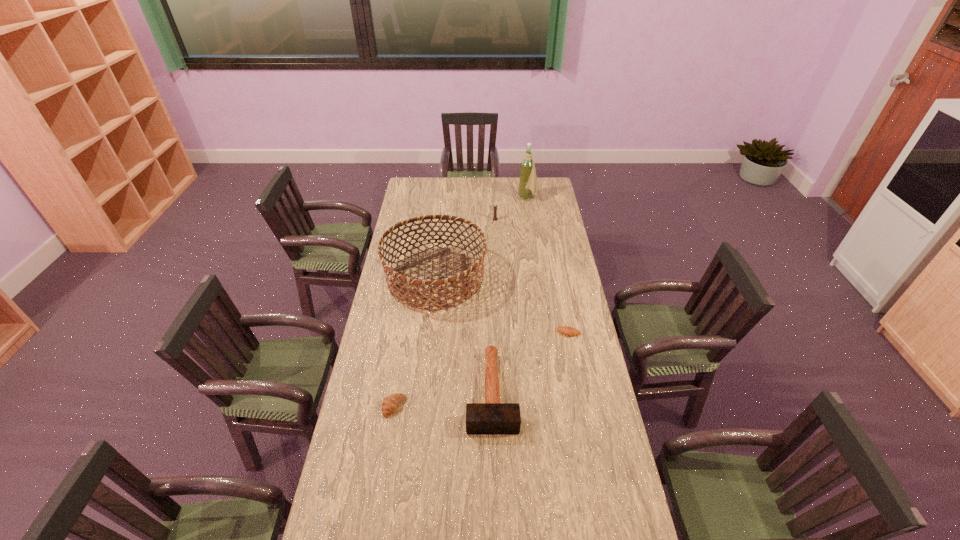
Find the location of a particular element. Image resolution: width=960 pixels, height=540 pixels. free space between the shorter crescent roll and the tallest object is located at coordinates (548, 266).

This screenshot has width=960, height=540. I want to click on empty space that is in between the fifth tallest object and the candle holder, so click(444, 313).

Find the location of a particular element. This screenshot has width=960, height=540. free point between the farthest object and the second shortest object is located at coordinates (461, 302).

Identify the location of free space that is in between the wine bottle and the mallet. Image resolution: width=960 pixels, height=540 pixels. (510, 294).

Where is `free space between the shortest object and the tallest object`? This screenshot has width=960, height=540. free space between the shortest object and the tallest object is located at coordinates pos(548,266).

Where is `object that is the second nearest to the mallet`? The width and height of the screenshot is (960, 540). object that is the second nearest to the mallet is located at coordinates (401, 288).

Where is `object that is the third nearest to the farthest object`? object that is the third nearest to the farthest object is located at coordinates tap(566, 330).

This screenshot has width=960, height=540. I want to click on vacant area that satisfies the following two spatial constraints: 1. on the front-facing side of the farthest object; 2. on the front side of the second farthest object, so click(531, 219).

I want to click on free spot that satisfies the following two spatial constraints: 1. on the front side of the candle holder; 2. on the left side of the shortest object, so click(500, 333).